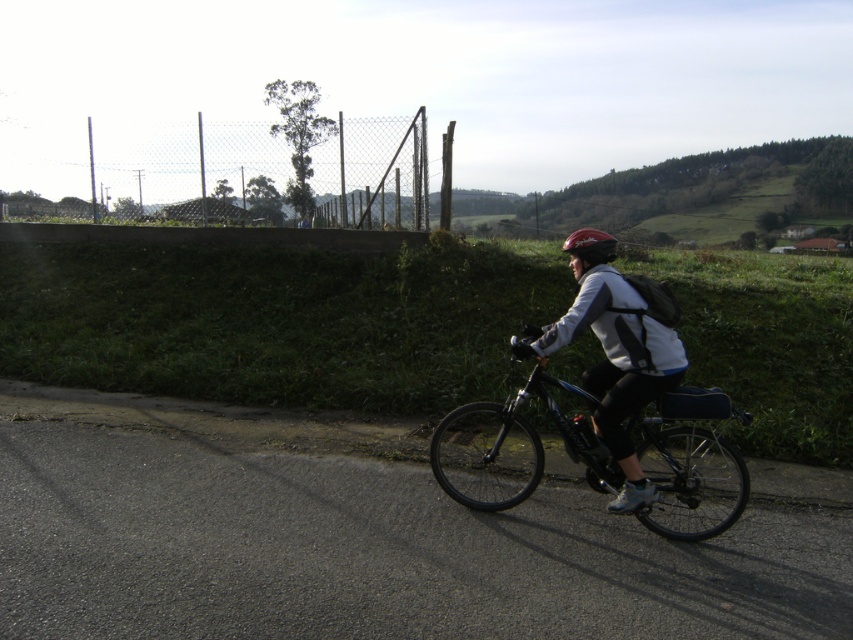
Question: Which point appears farthest from the camera in this image?

Choices:
 (A) (599, 452)
 (B) (575, 240)
 (C) (502, 499)

Answer: (C)

Question: Which point is farther from the camera taking this photo?

Choices:
 (A) (587, 380)
 (B) (628, 440)
 (C) (602, 259)

Answer: (A)

Question: Which object is positioned closest to the white matte jacket at center?

Choices:
 (A) shiny red helmet at center
 (B) shiny blue bicycle at center

Answer: (B)

Question: Is white matte jacket at center above shiny red helmet at center?

Choices:
 (A) no
 (B) yes

Answer: (A)

Question: Is white matte jacket at center in front of shiny red helmet at center?

Choices:
 (A) yes
 (B) no

Answer: (A)

Question: Is shiny blue bicycle at center smaller than shiny red helmet at center?

Choices:
 (A) no
 (B) yes

Answer: (A)